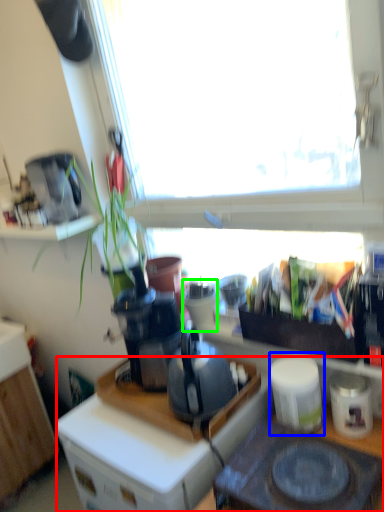
Question: Estimate the real-world distances between objects in this image. Which object is farther from desk (highlighted by a red box), appliance (highlighted by a blue box) or appliance (highlighted by a green box)?

Choices:
 (A) appliance
 (B) appliance

Answer: (B)